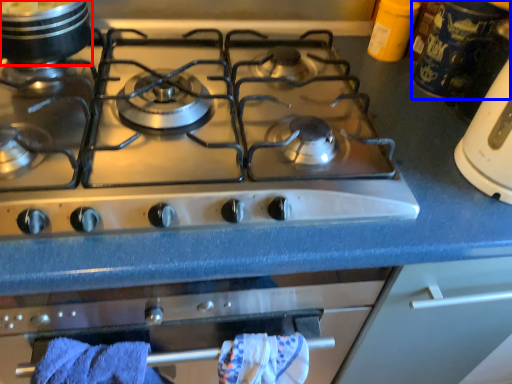
Question: Among these objects, which one is nearest to the camera, kitchen appliance (highlighted by a red box) or appliance (highlighted by a blue box)?

Choices:
 (A) kitchen appliance
 (B) appliance

Answer: (A)